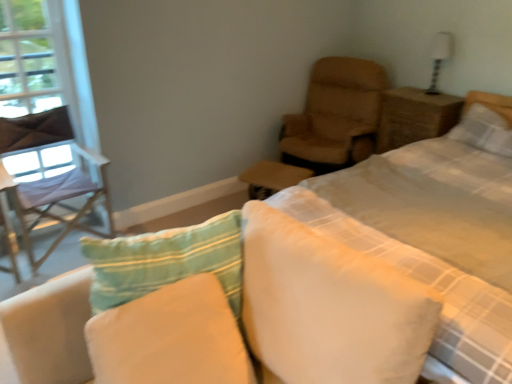
You are a GUI agent. You are given a task and a screenshot of the screen. Output one action in this format:
    pyautogui.click(x=<x>, y=<y>)
    Task: Click on the blank area beneath white glossy table lamp at upper right (from a real-world perspective)
    This screenshot has width=512, height=384.
    Given the screenshot: What is the action you would take?
    433,96